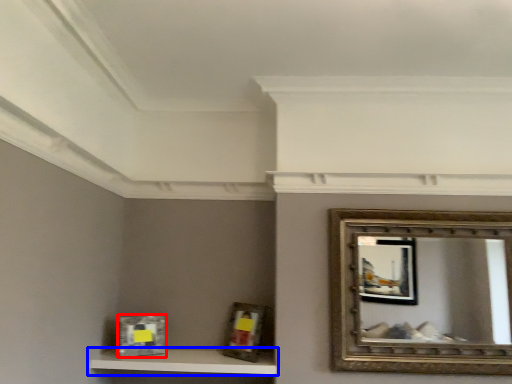
Question: Which point is closer to the camera, picture frame (highlighted by a red box) or shelf (highlighted by a blue box)?

Choices:
 (A) picture frame
 (B) shelf

Answer: (B)